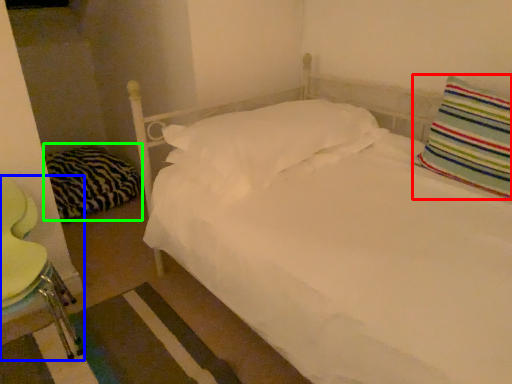
Question: Considering the real-world distances, which object is closest to pillow (highlighted by a red box)? swivel chair (highlighted by a blue box) or pillow (highlighted by a green box).

Choices:
 (A) swivel chair
 (B) pillow

Answer: (A)